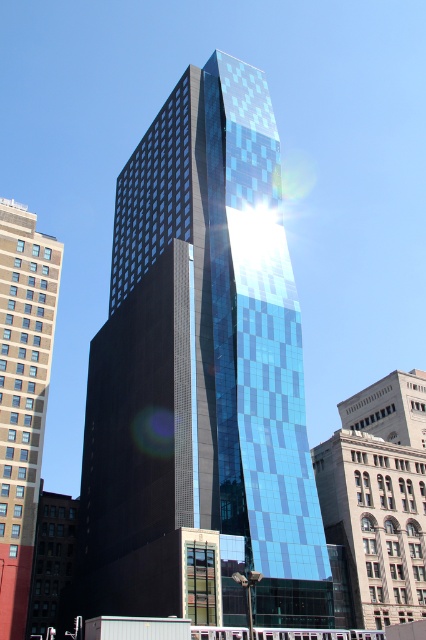
Question: Which is farther from the beige concrete building at left?

Choices:
 (A) shiny glass skyscraper at center
 (B) blue glass skyscraper at center

Answer: (B)

Question: Which of the following is the closest to the observer?

Choices:
 (A) blue glass skyscraper at center
 (B) shiny glass skyscraper at center
 (C) beige concrete building at left

Answer: (B)

Question: Is blue glass skyscraper at center to the left of beige concrete building at left from the viewer's perspective?

Choices:
 (A) yes
 (B) no

Answer: (B)

Question: Among these objects, which one is nearest to the camera?

Choices:
 (A) blue glass skyscraper at center
 (B) shiny glass skyscraper at center

Answer: (B)

Question: Can you confirm if shiny glass skyscraper at center is thinner than blue glass skyscraper at center?

Choices:
 (A) no
 (B) yes

Answer: (A)

Question: In this image, where is blue glass skyscraper at center located relative to beige concrete building at left?

Choices:
 (A) above
 (B) below

Answer: (B)